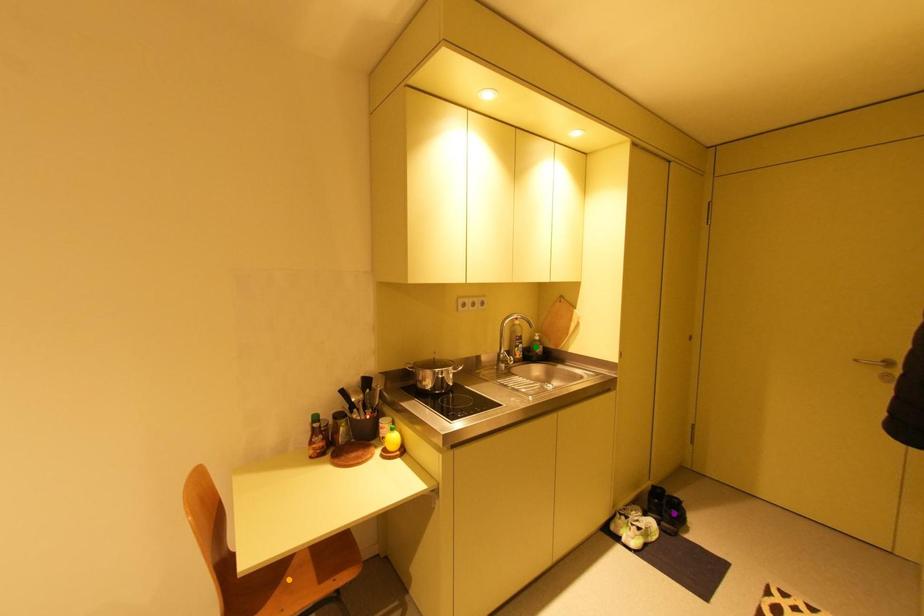
Order these from nearest to farthest:
purple point
orange point
green point

1. orange point
2. purple point
3. green point